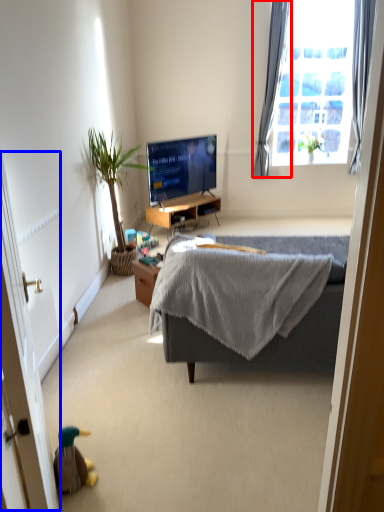
Question: Which point is closer to the camera, curtain (highlighted by a red box) or screen door (highlighted by a blue box)?

Choices:
 (A) curtain
 (B) screen door

Answer: (B)